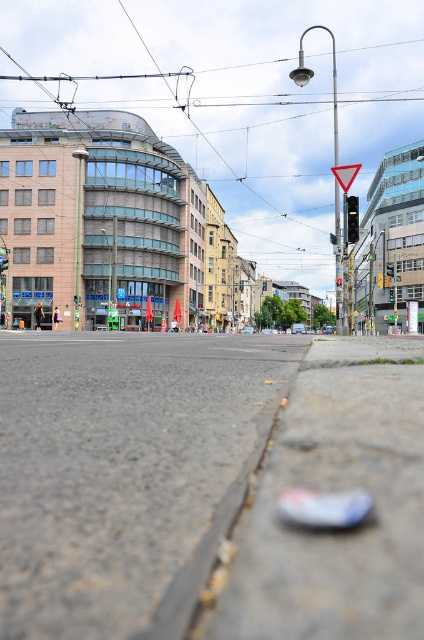
You are a delivery robot that needs to navigate between the black glass traffic light at center and the black plastic traffic light at upper center. Given that your maximum turning radius is 6 feet, can you maneuver between them without hitting either?

The distance between the black glass traffic light at center and the black plastic traffic light at upper center is 5.53 feet. Since your turning radius is 6 feet, which is larger than the distance between them, you can safely maneuver between them without collision.

You are a delivery robot that needs to deliver a package to the black glass traffic light at center. You are currently on the gray asphalt pavement at lower center. What should you do to reach the traffic light?

The gray asphalt pavement at lower center has a lesser height compared to black glass traffic light at center, so you should ascend from the gray asphalt pavement at lower center to reach the black glass traffic light at center since it is elevated.

You are a delivery robot with a 1.2 meter wide package. You need to navigate through the street scene shown in the image. Can you pass between the gray asphalt pavement at lower center and the black plastic traffic light at upper center without tilting the package?

The gray asphalt pavement at lower center is wider than the black plastic traffic light at upper center. Since the package is 1.2 meters wide, you can pass through the space between them as long as the total width allows it. However, the exact width isn